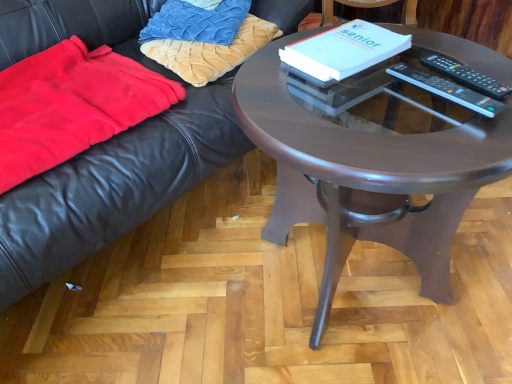
This screenshot has height=384, width=512. In order to click on vacant region to the left of black plastic remote control at upper right, placed as the 1th remote control when sorted from right to left in this screenshot , I will do `click(402, 76)`.